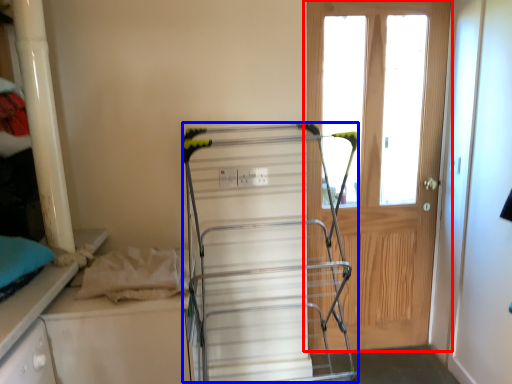
Question: Which of the following is the farthest to the observer, door (highlighted by a red box) or wide (highlighted by a blue box)?

Choices:
 (A) door
 (B) wide

Answer: (A)